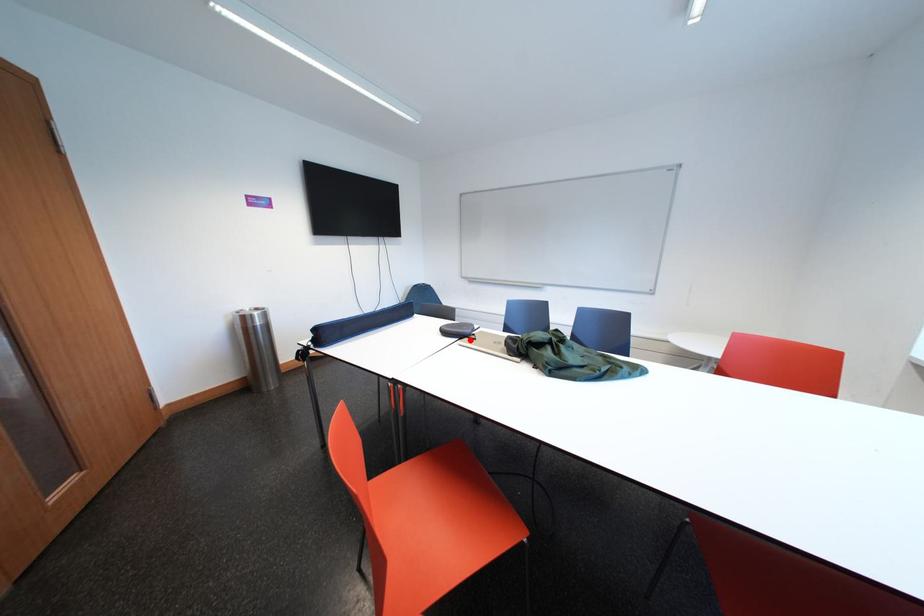
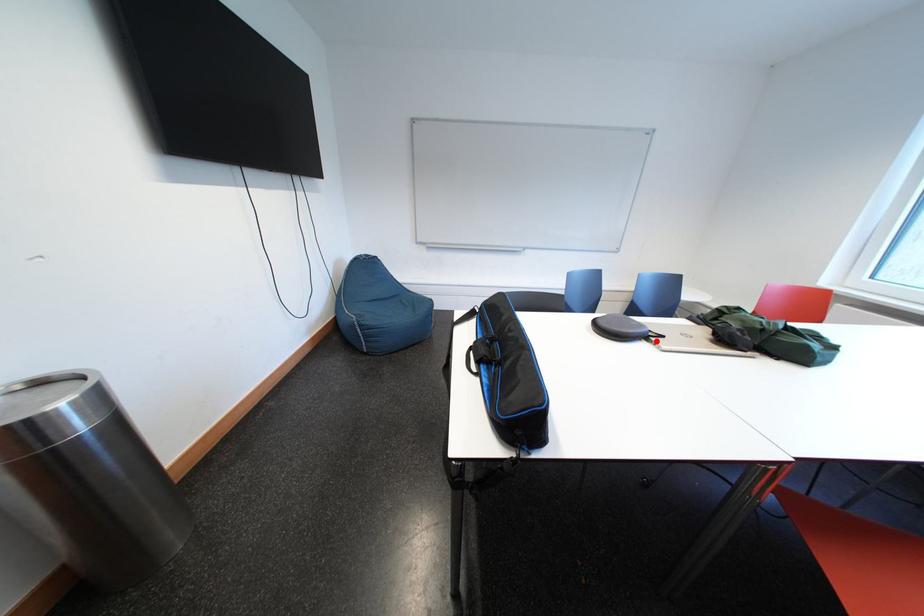
I am providing you with two images of the same scene from different viewpoints. A red point is marked on the first image and another point is marked on the second image. Is the marked point in image1 the same physical position as the marked point in image2?

Yes